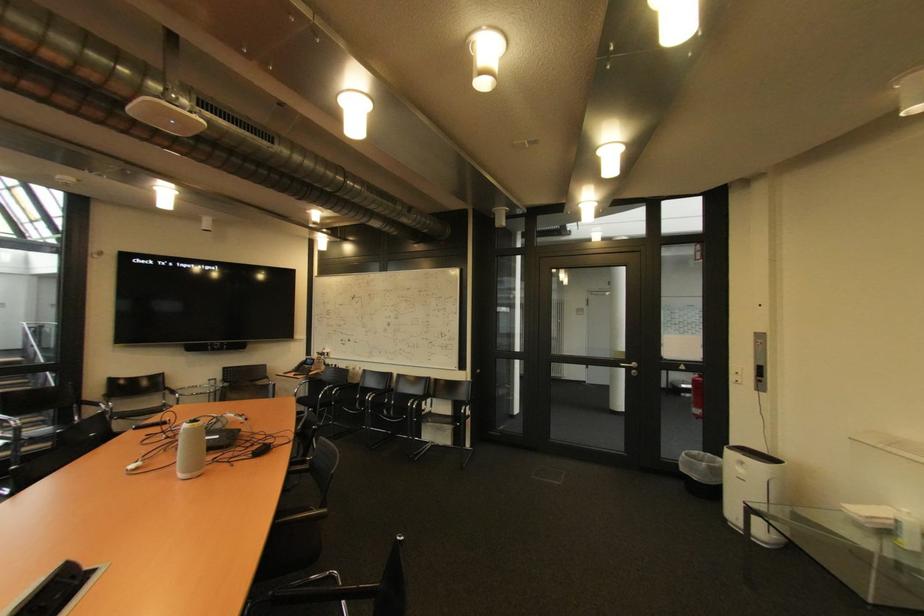
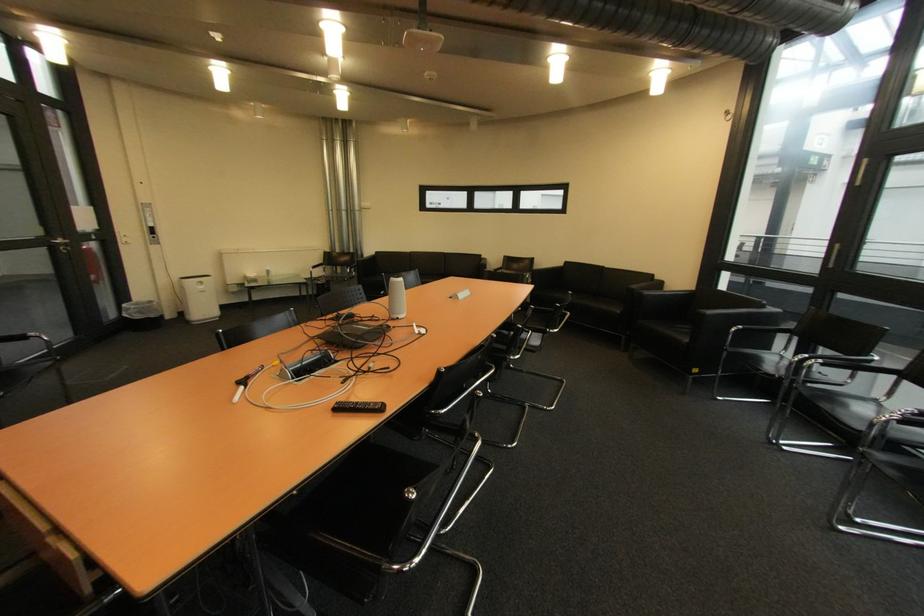
Locate, in the second image, the point that corresponds to (x=748, y=471) in the first image.

(209, 288)